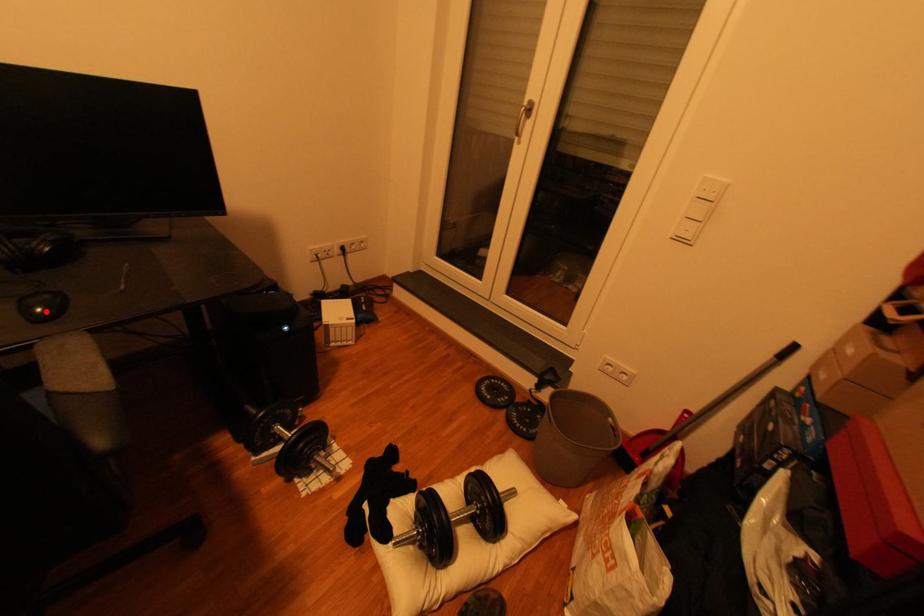
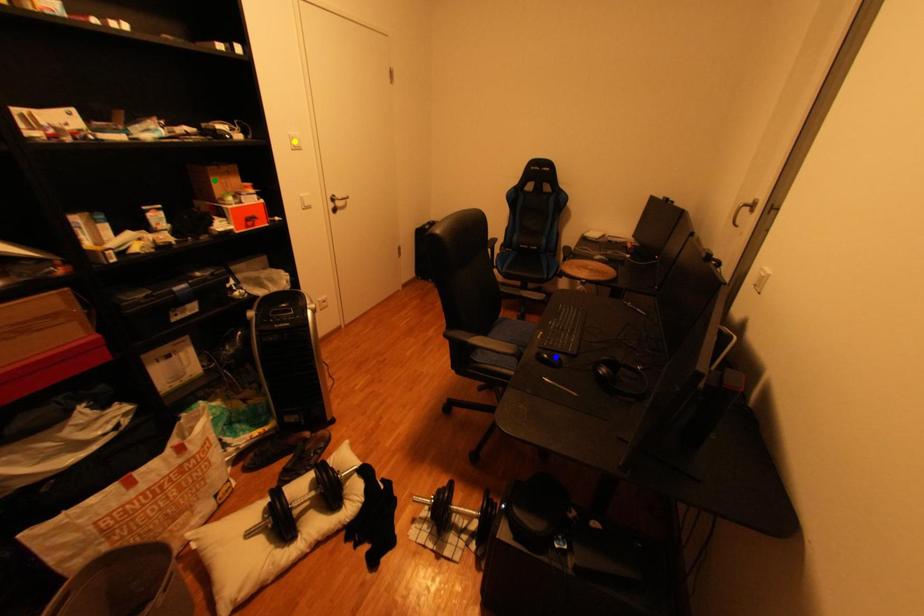
Question: I am providing you with two images of the same scene from different viewpoints. A red point is marked on the first image. You are given multiple points on the second image. Can you choose the point in image 2 that corresponds to the point in image 1?

Choices:
 (A) green point
 (B) blue point
 (C) yellow point

Answer: (B)